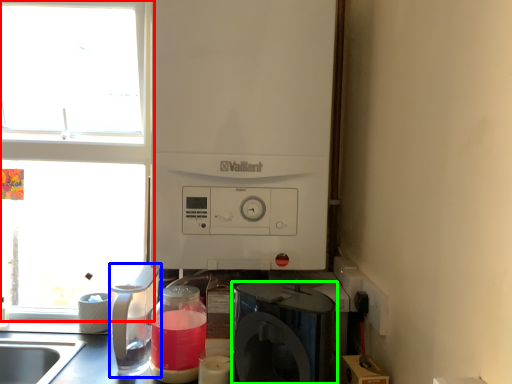
Question: Considering the real-world distances, which object is closest to window (highlighted by a red box)? kitchen appliance (highlighted by a blue box) or home appliance (highlighted by a green box).

Choices:
 (A) kitchen appliance
 (B) home appliance

Answer: (A)